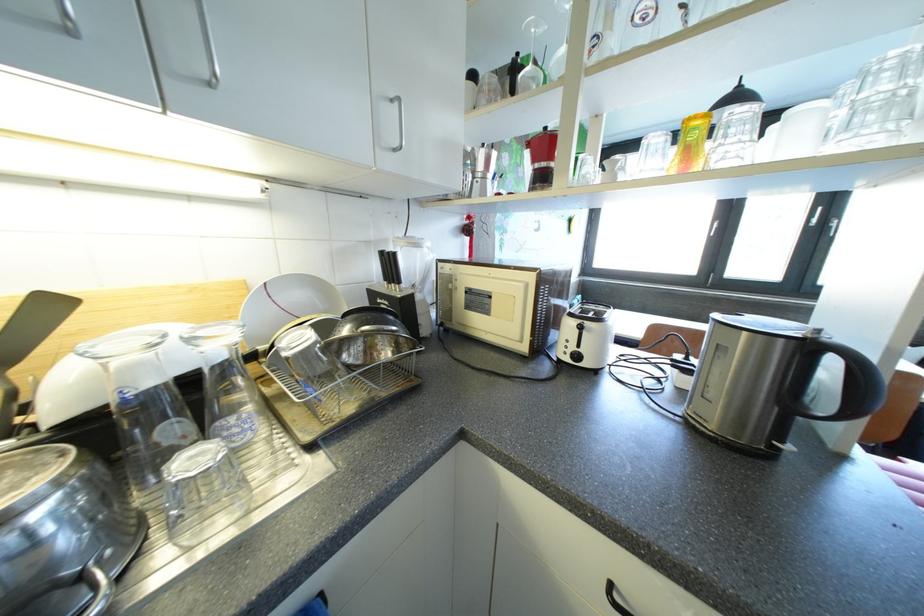
The location [562,195] corresponds to which object?

This point indicates the tall drinking glass.